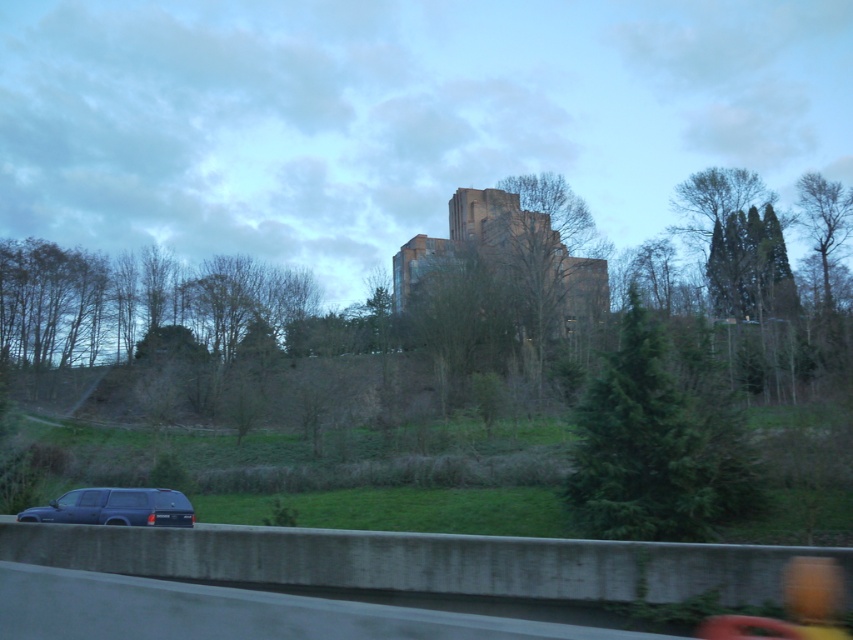
Question: Which is nearer to the matte black car window at lower left?

Choices:
 (A) matte black suv at lower left
 (B) brown textured tree at center
 (C) green leafy tree at upper right

Answer: (A)

Question: Considering the real-world distances, which object is closest to the matte black suv at lower left?

Choices:
 (A) matte black car window at lower left
 (B) transparent glass car window at lower left

Answer: (A)

Question: Estimate the real-world distances between objects in this image. Which object is farther from the matte black suv at lower left?

Choices:
 (A) brown textured tree at center
 (B) green leafy tree at upper right

Answer: (B)

Question: Does rustic stone castle at center have a lesser width compared to transparent glass car window at lower left?

Choices:
 (A) yes
 (B) no

Answer: (B)

Question: Is matte black car window at lower left in front of clear glass window at lower left?

Choices:
 (A) no
 (B) yes

Answer: (B)

Question: Can you confirm if rustic stone castle at center is positioned below clear glass window at lower left?

Choices:
 (A) yes
 (B) no

Answer: (B)